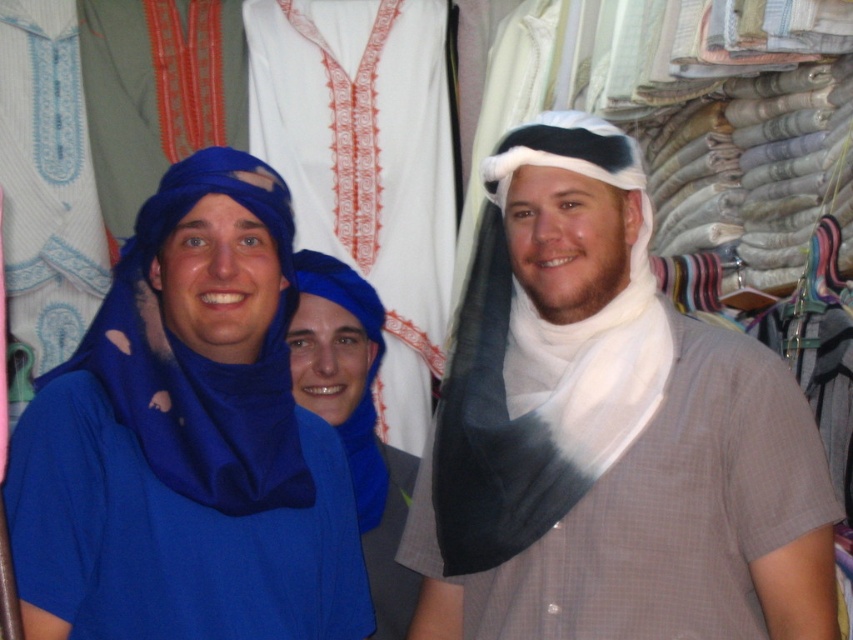
Question: Which of the following is the farthest from the observer?

Choices:
 (A) 578,360
 (B) 532,600
 (C) 341,342
 (D) 281,337

Answer: (C)

Question: Does white matte headscarf at center have a larger size compared to blue cotton turban at center?

Choices:
 (A) yes
 (B) no

Answer: (A)

Question: Is white matte headscarf at center bigger than white sheer scarf at center?

Choices:
 (A) yes
 (B) no

Answer: (A)

Question: Among these points, which one is nearest to the camera?

Choices:
 (A) (155, 406)
 (B) (329, 397)

Answer: (A)

Question: Does white matte headscarf at center have a smaller size compared to blue soft fabric scarf at left?

Choices:
 (A) no
 (B) yes

Answer: (A)

Question: Which point appears farthest from the camera in this image?

Choices:
 (A) (370, 468)
 (B) (287, 429)

Answer: (A)